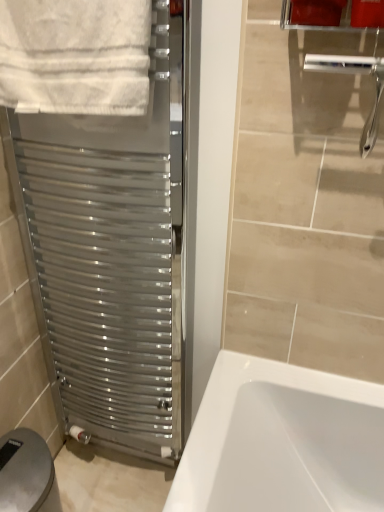
Find the location of `satin metallic towel warmer at left`. satin metallic towel warmer at left is located at coordinates (107, 254).

Locate an element on the screen. matte plastic toilet paper holder at lower left is located at coordinates (27, 473).

From a real-world perspective, is white cotton towel at upper left beneath matte plastic toilet paper holder at lower left?

No, from a real-world perspective, white cotton towel at upper left is not beneath matte plastic toilet paper holder at lower left.

Is white cotton towel at upper left taller than matte plastic toilet paper holder at lower left?

Incorrect, the height of white cotton towel at upper left is not larger of that of matte plastic toilet paper holder at lower left.

Is white cotton towel at upper left bigger than matte plastic toilet paper holder at lower left?

Actually, white cotton towel at upper left might be smaller than matte plastic toilet paper holder at lower left.

In the image, is white cotton towel at upper left positioned in front of or behind matte plastic toilet paper holder at lower left?

Visually, white cotton towel at upper left is located in front of matte plastic toilet paper holder at lower left.

In the scene shown: From a real-world perspective, is satin metallic towel warmer at left physically located above or below matte plastic toilet paper holder at lower left?

satin metallic towel warmer at left is above matte plastic toilet paper holder at lower left.

Is satin metallic towel warmer at left spatially inside matte plastic toilet paper holder at lower left, or outside of it?

satin metallic towel warmer at left is not inside matte plastic toilet paper holder at lower left, it's outside.

Does satin metallic towel warmer at left lie behind matte plastic toilet paper holder at lower left?

That is False.

Is matte plastic toilet paper holder at lower left at the back of satin metallic towel warmer at left?

That's not correct — satin metallic towel warmer at left is not looking away from matte plastic toilet paper holder at lower left.

Is satin metallic towel warmer at left oriented away from white cotton towel at upper left?

Yes, white cotton towel at upper left is at the back of satin metallic towel warmer at left.

Between satin metallic towel warmer at left and white cotton towel at upper left, which one has more height?

With more height is satin metallic towel warmer at left.

Is satin metallic towel warmer at left beside white cotton towel at upper left?

There is a gap between satin metallic towel warmer at left and white cotton towel at upper left.

Is satin metallic towel warmer at left not inside white cotton towel at upper left?

That's correct, satin metallic towel warmer at left is outside of white cotton towel at upper left.

From the image's perspective, which one is positioned higher, matte plastic toilet paper holder at lower left or satin metallic towel warmer at left?

satin metallic towel warmer at left is shown above in the image.

Does matte plastic toilet paper holder at lower left turn towards satin metallic towel warmer at left?

No, matte plastic toilet paper holder at lower left is not facing towards satin metallic towel warmer at left.

Based on their positions, is matte plastic toilet paper holder at lower left located to the left or right of satin metallic towel warmer at left?

Based on their positions, matte plastic toilet paper holder at lower left is located to the left of satin metallic towel warmer at left.

Does matte plastic toilet paper holder at lower left contain satin metallic towel warmer at left?

No, satin metallic towel warmer at left is not inside matte plastic toilet paper holder at lower left.

Is white cotton towel at upper left closer to the viewer compared to satin metallic towel warmer at left?

Yes, white cotton towel at upper left is in front of satin metallic towel warmer at left.

The width and height of the screenshot is (384, 512). Identify the location of screen door behind the white cotton towel at upper left. (107, 254).

Is white cotton towel at upper left not close to satin metallic towel warmer at left?

No, white cotton towel at upper left is in close proximity to satin metallic towel warmer at left.

Could you tell me if white cotton towel at upper left is facing satin metallic towel warmer at left?

No, white cotton towel at upper left is not aimed at satin metallic towel warmer at left.

From the image's perspective, which one is positioned lower, matte plastic toilet paper holder at lower left or white cotton towel at upper left?

matte plastic toilet paper holder at lower left appears lower in the image.

Is matte plastic toilet paper holder at lower left touching white cotton towel at upper left?

matte plastic toilet paper holder at lower left and white cotton towel at upper left are clearly separated.

The image size is (384, 512). In order to click on gray behind the white cotton towel at upper left in this screenshot , I will do `click(27, 473)`.

Where is `gray beneath the white cotton towel at upper left (from a real-world perspective)`? gray beneath the white cotton towel at upper left (from a real-world perspective) is located at coordinates (27, 473).

Find the location of a particular element. The image size is (384, 512). gray below the satin metallic towel warmer at left (from the image's perspective) is located at coordinates (27, 473).

Looking at this image, when comparing their distances from satin metallic towel warmer at left, does matte plastic toilet paper holder at lower left or white cotton towel at upper left seem further?

Among the two, matte plastic toilet paper holder at lower left is located further to satin metallic towel warmer at left.

When comparing their distances from white cotton towel at upper left, does matte plastic toilet paper holder at lower left or satin metallic towel warmer at left seem further?

matte plastic toilet paper holder at lower left is further to white cotton towel at upper left.

From the image, which object appears to be nearer to satin metallic towel warmer at left, white cotton towel at upper left or matte plastic toilet paper holder at lower left?

white cotton towel at upper left is closer to satin metallic towel warmer at left.

When comparing their distances from white cotton towel at upper left, does satin metallic towel warmer at left or matte plastic toilet paper holder at lower left seem closer?

satin metallic towel warmer at left lies closer to white cotton towel at upper left than the other object.

From the image, which object appears to be nearer to matte plastic toilet paper holder at lower left, white cotton towel at upper left or satin metallic towel warmer at left?

satin metallic towel warmer at left is closer to matte plastic toilet paper holder at lower left.

Considering their positions, is satin metallic towel warmer at left positioned closer to matte plastic toilet paper holder at lower left than white cotton towel at upper left?

Among the two, satin metallic towel warmer at left is located nearer to matte plastic toilet paper holder at lower left.

You are a GUI agent. You are given a task and a screenshot of the screen. Output one action in this format:
    pyautogui.click(x=<x>, y=<y>)
    Task: Click on the screen door between white cotton towel at upper left and matte plastic toilet paper holder at lower left vertically
    
    Given the screenshot: What is the action you would take?
    pyautogui.click(x=107, y=254)